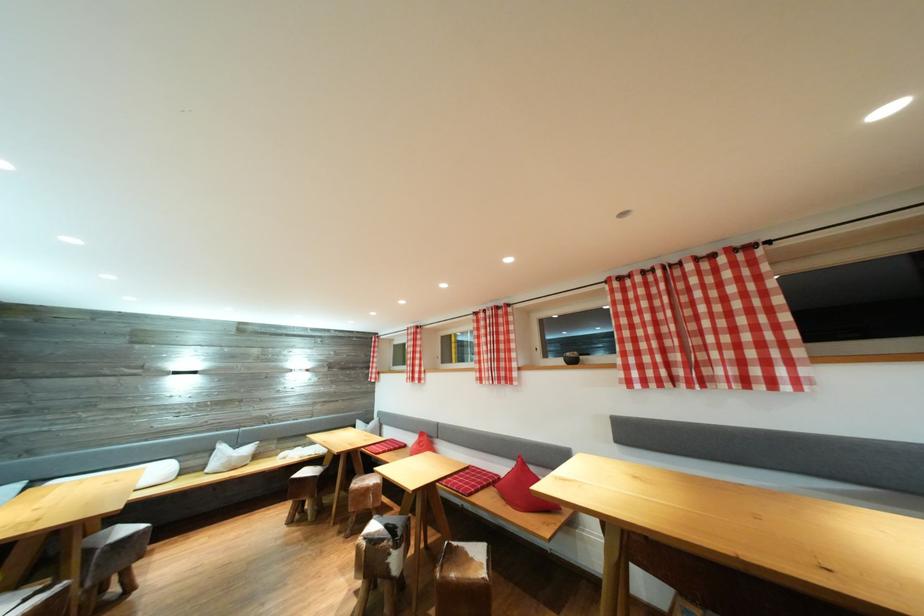
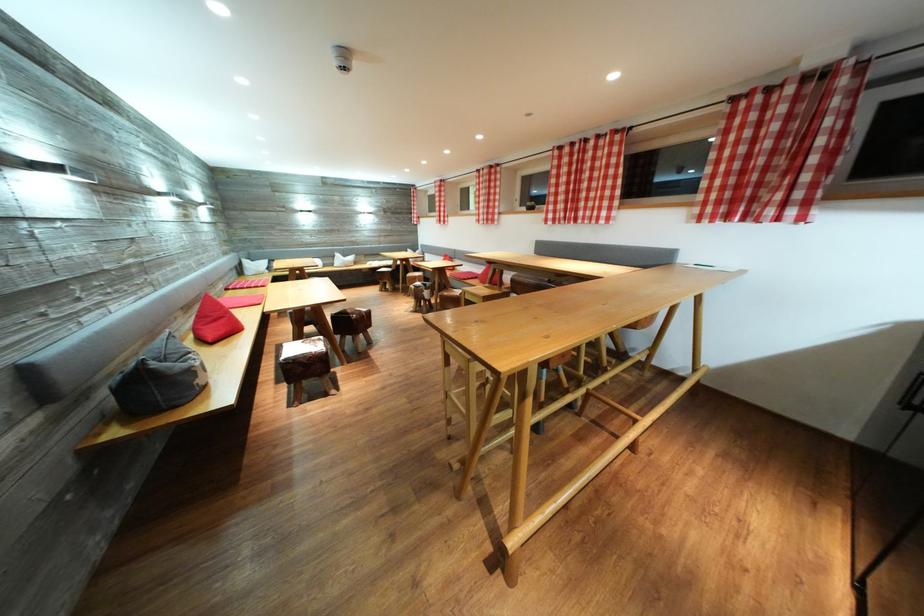
In the second image, find the point that corresponds to [310,508] in the first image.

(393, 289)